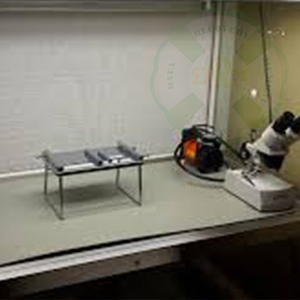
The width and height of the screenshot is (300, 300). Identify the location of table. [x=161, y=227].